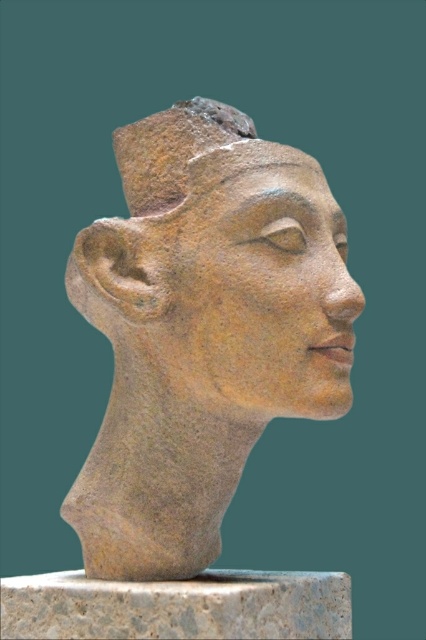
You are an archaeologist examining a stone sculpture. The sculpture has a point marked at coordinates (221, 269). Based on the description, can you identify what part of the sculpture this point corresponds to?

The point (221, 269) corresponds to the earthenware statue at center.

You are standing in front of the stone sculpture of a human head. There is a specific point marked at coordinates point (169,237). If you want to touch this point without moving your hand from your current position, can you reach it?

The point (169,237) is 3.55 feet away from the viewer, so if you are standing in front of the sculpture and your hand can extend 3.55 feet, you can reach it. However, typical human arm length is about 2.5 feet, so you might need to take a step forward or extend your arm fully to touch it.

You are an archaeologist examining the stone sculpture. Based on the coordinates provided, can you determine the position of the earthenware statue at center relative to the center of the image?

The earthenware statue at center is located at coordinates approximately 42.2 cm to the right and 52.1 cm above the center point of the image, based on the coordinate system provided.